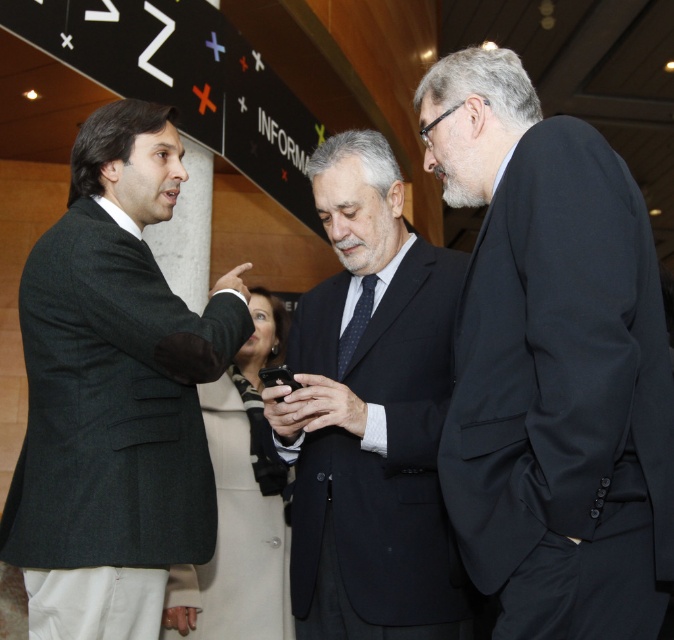
Between black matte suit at right and dark blue suit at center, which one appears on the left side from the viewer's perspective?

dark blue suit at center is more to the left.

Is point (514, 301) behind point (398, 636)?

No, it is not.

Is point (512, 632) positioned after point (274, 435)?

No, it is in front of (274, 435).

Locate an element on the screen. black matte suit at right is located at coordinates (551, 364).

Does smooth black suit at center have a lesser height compared to black matte phone at center?

Yes.

Does point (311, 381) lie in front of point (264, 412)?

Yes, point (311, 381) is closer to viewer.

The width and height of the screenshot is (674, 640). What are the coordinates of `smooth black suit at center` in the screenshot? It's located at [324, 406].

Is dark gray wool suit at left positioned in front of black matte phone at center?

Yes.

Does dark gray wool suit at left appear on the left side of black matte phone at center?

Yes, dark gray wool suit at left is to the left of black matte phone at center.

Is point (146, 602) less distant than point (272, 410)?

Yes, it is in front of point (272, 410).

At what (x,y) coordinates should I click in order to perform the action: click on dark gray wool suit at left. Please return your answer as a coordinate pair (x, y). The image size is (674, 640). Looking at the image, I should click on (115, 392).